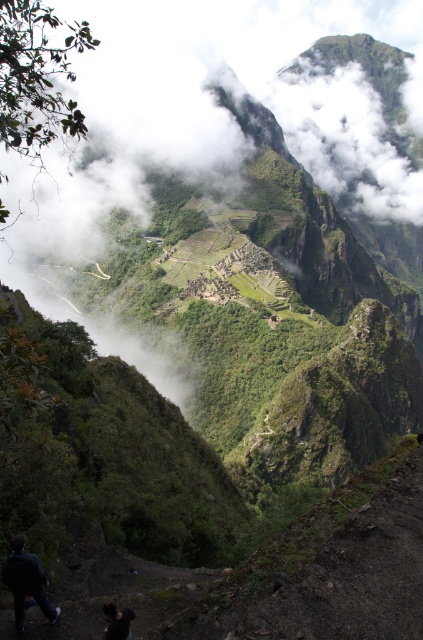
You are a hiker standing on the dirt path at the lower left of the scene. You want to take a photo of the dark brown hair at lower left without including the dark blue jacket at lower left in the frame. Is this possible given their positions?

The dark blue jacket at lower left is further to the viewer than dark brown hair at lower left, so the dark brown hair at lower left is behind the dark blue jacket at lower left. To avoid including the dark blue jacket at lower left in the photo, you would need to move closer to the dark brown hair at lower left or adjust your angle to exclude it.

You are standing at the entrance of Machu Picchu and see the dark blue jacket at lower left. If you want to reach the jacket, how many steps do you need to take? Assume each step covers 0.75 meters.

The dark blue jacket at lower left is 22.81 meters away from viewer. Dividing the distance by step length 22.81 divided by 0.75 equals approximately 30.41 steps. So you would need to take about 30 steps to reach the jacket.

You are a tourist at Machu Picchu and see a dark blue jacket at lower left and a dark brown hair at lower left. Which object is located more to the left side?

The dark blue jacket at lower left is positioned on the left side of dark brown hair at lower left, so the dark blue jacket at lower left is more to the left.